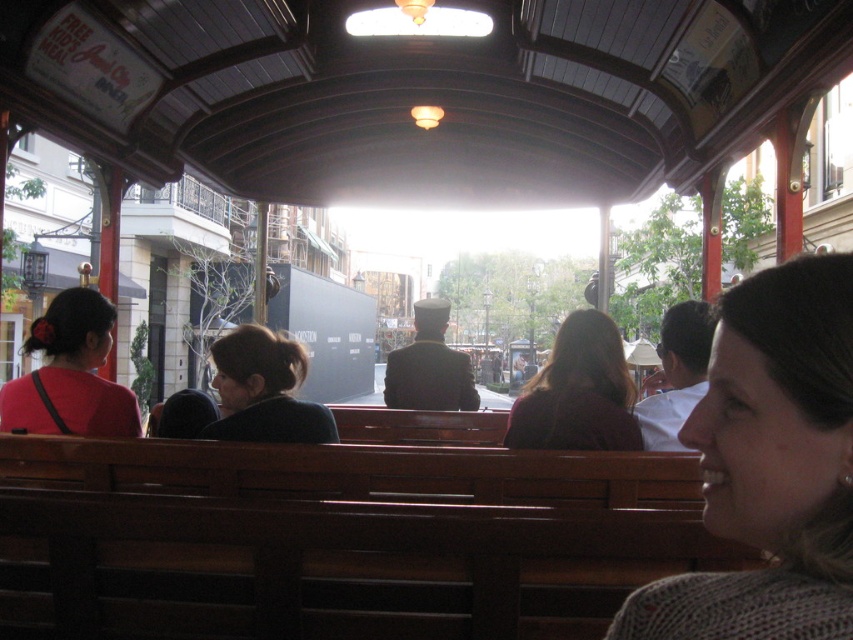
Is dark brown hair at center shorter than dark blue sweater at center?

No, dark brown hair at center is not shorter than dark blue sweater at center.

Is point (621, 365) positioned before point (291, 364)?

No, it is behind (291, 364).

What are the coordinates of `dark brown hair at center` in the screenshot? It's located at (578, 392).

Which is below, gray knitted sweater at lower right or matte red shirt at left?

Positioned lower is gray knitted sweater at lower right.

Does point (753, 592) come closer to viewer compared to point (93, 400)?

Yes, point (753, 592) is closer to viewer.

The height and width of the screenshot is (640, 853). I want to click on gray knitted sweater at lower right, so click(x=770, y=465).

Between matte red shirt at left and dark blue sweater at center, which one appears on the left side from the viewer's perspective?

matte red shirt at left

At what (x,y) coordinates should I click in order to perform the action: click on matte red shirt at left. Please return your answer as a coordinate pair (x, y). The height and width of the screenshot is (640, 853). Looking at the image, I should click on (70, 374).